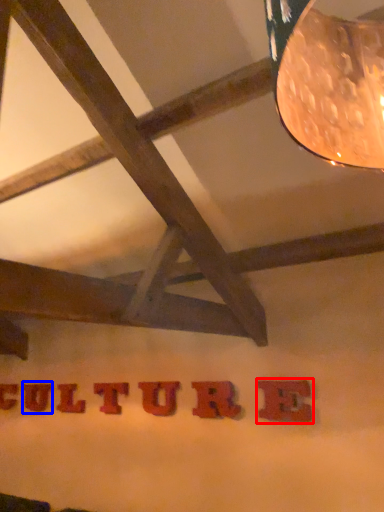
Question: Which object is closer to the camera taking this photo, letter (highlighted by a red box) or letter (highlighted by a blue box)?

Choices:
 (A) letter
 (B) letter

Answer: (A)